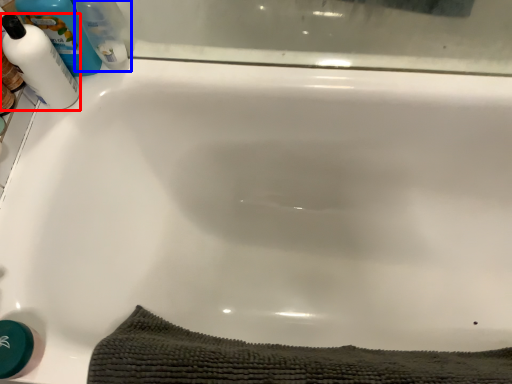
Question: Which of the following is the closest to the observer, cleaning product (highlighted by a red box) or cleaning product (highlighted by a blue box)?

Choices:
 (A) cleaning product
 (B) cleaning product

Answer: (A)